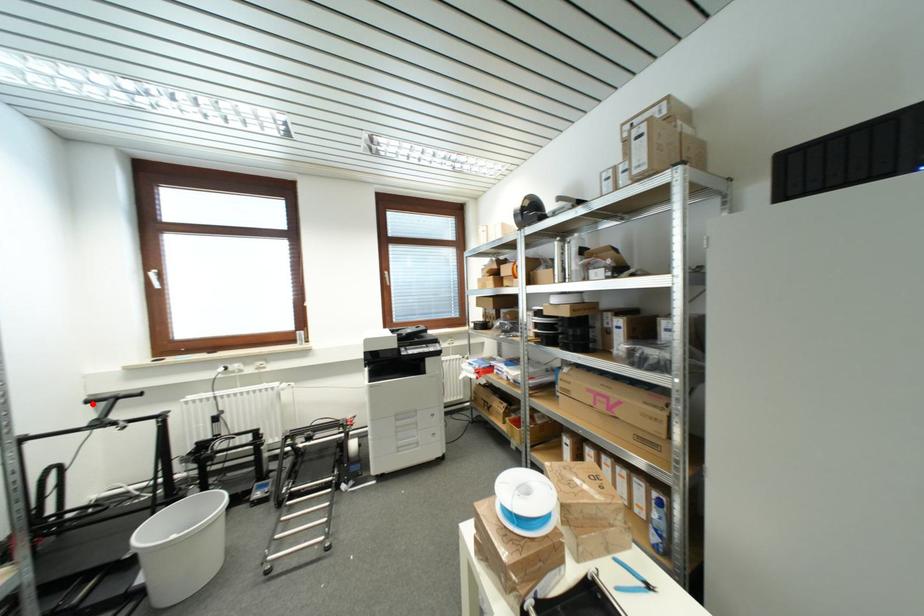
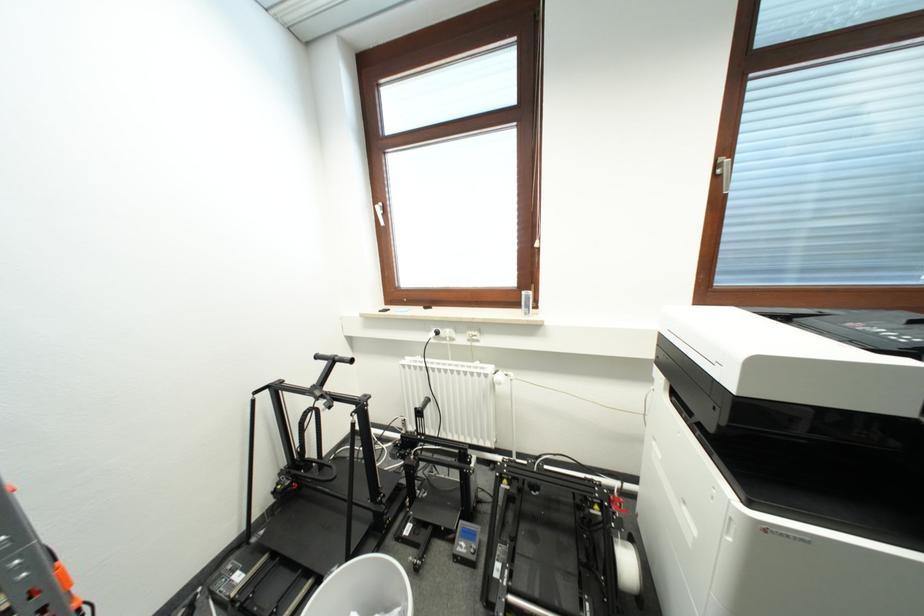
The point at the highlighted location is marked in the first image. Where is the corresponding point in the second image?

(322, 360)